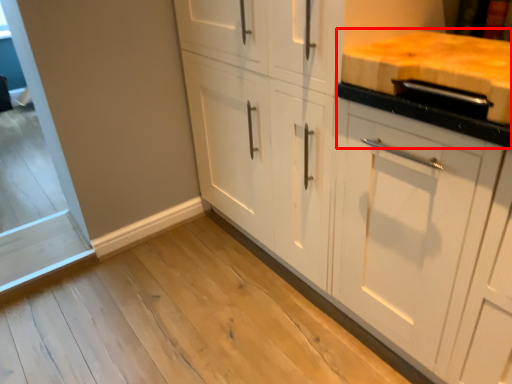
Question: From the image's perspective, what is the correct spatial relationship of countertop (annotated by the red box) in relation to cabinetry?

Choices:
 (A) below
 (B) above

Answer: (B)